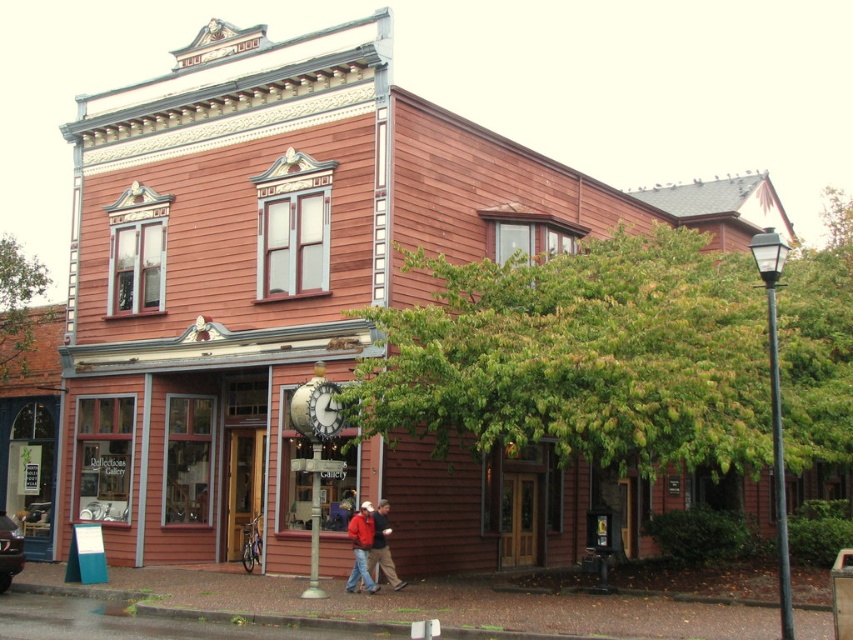
Question: Can you confirm if wooden storefront at center is thinner than wooden clock at center?

Choices:
 (A) yes
 (B) no

Answer: (B)

Question: Is red jacket at center positioned in front of wooden clock at center?

Choices:
 (A) no
 (B) yes

Answer: (A)

Question: Which of the following is the closest to the observer?

Choices:
 (A) wooden clock at center
 (B) wooden storefront at center

Answer: (A)

Question: Which object is the farthest from the red jacket at center?

Choices:
 (A) wooden storefront at center
 (B) wooden clock at center

Answer: (A)

Question: In this image, where is wooden storefront at center located relative to wooden clock at center?

Choices:
 (A) left
 (B) right

Answer: (A)

Question: Among these objects, which one is farthest from the camera?

Choices:
 (A) wooden clock at center
 (B) red jacket at center

Answer: (B)